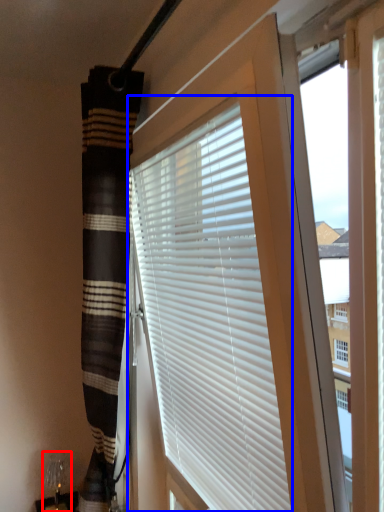
Question: Which object is closer to the camera taking this photo, table lamp (highlighted by a red box) or window blind (highlighted by a blue box)?

Choices:
 (A) table lamp
 (B) window blind

Answer: (B)